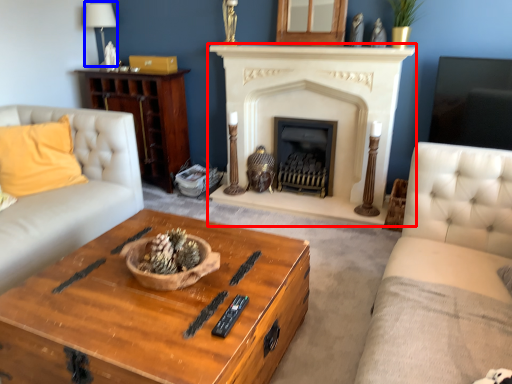
Question: Among these objects, which one is nearest to the camera, fireplace (highlighted by a red box) or lamp (highlighted by a blue box)?

Choices:
 (A) fireplace
 (B) lamp

Answer: (A)